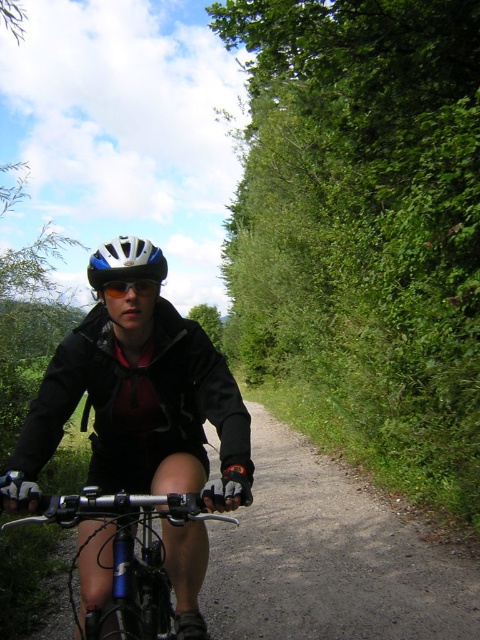
Who is taller, matte black jacket at center or white matte bicycle helmet at center?

With more height is white matte bicycle helmet at center.

Between point (149, 426) and point (105, 246), which one is positioned behind?

The point (149, 426) is more distant.

The height and width of the screenshot is (640, 480). In order to click on matte black jacket at center in this screenshot , I will do `click(137, 404)`.

In the scene shown: Can you confirm if blue metallic bicycle at center is smaller than white matte bicycle helmet at center?

Correct, blue metallic bicycle at center occupies less space than white matte bicycle helmet at center.

What do you see at coordinates (130, 554) in the screenshot?
I see `blue metallic bicycle at center` at bounding box center [130, 554].

Where is `blue metallic bicycle at center`? blue metallic bicycle at center is located at coordinates (130, 554).

Between point (104, 412) and point (126, 509), which one is positioned in front?

Point (126, 509) is more forward.

Which is behind, point (152, 385) or point (153, 563)?

Point (152, 385)

The height and width of the screenshot is (640, 480). In order to click on matte black jacket at center in this screenshot , I will do `click(137, 404)`.